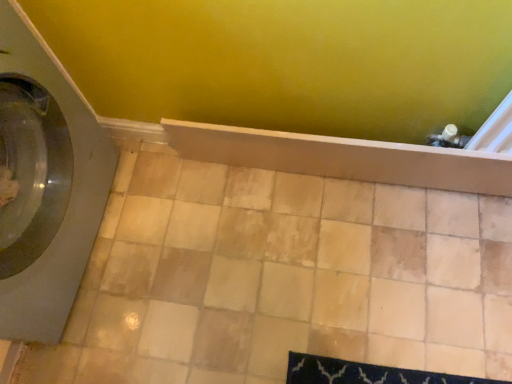
Find the location of a particular element. free space to the left of wooden shelf at center is located at coordinates (205, 238).